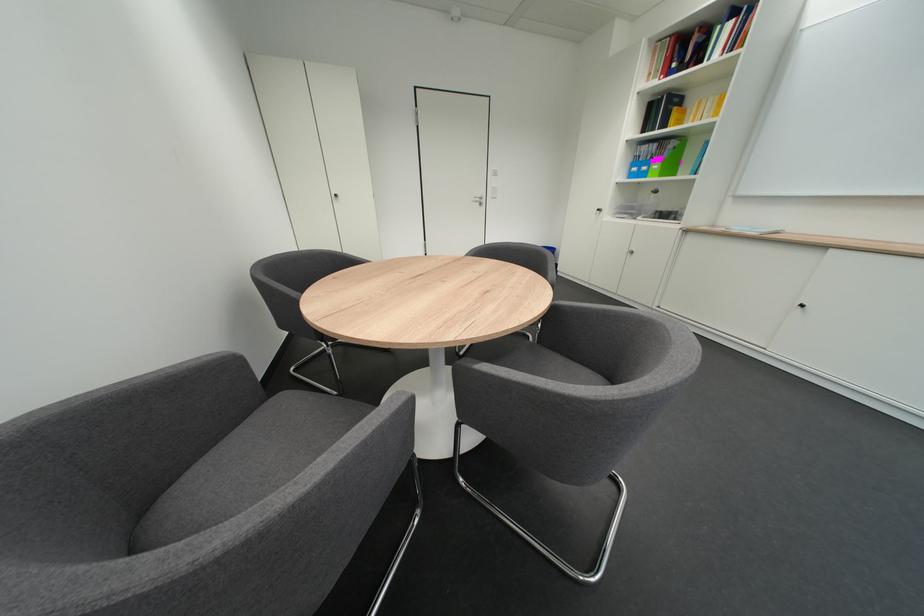
At what (x,y) coordinates should I click in order to perform the action: click on silver cabinet knob. Please return your answer as a coordinate pair (x, y). Looking at the image, I should click on (800, 305).